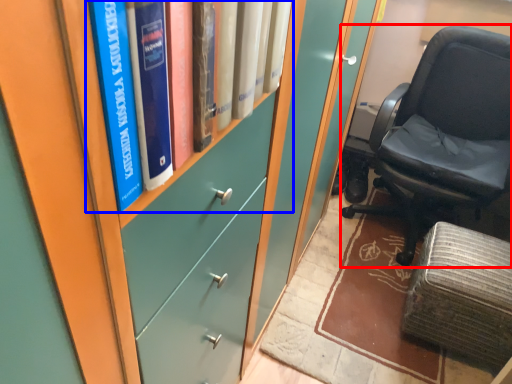
Question: Among these objects, which one is nearest to the camera, chair (highlighted by a red box) or book (highlighted by a blue box)?

Choices:
 (A) chair
 (B) book

Answer: (B)